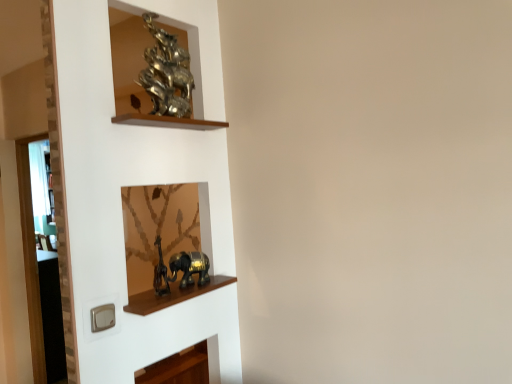
Question: Is the position of wooden shelf at upper center, marked as the first cabinet in a top-to-bottom arrangement, more distant than that of shiny metallic sculpture at upper left, positioned as the 1th art in top-to-bottom order?

Choices:
 (A) yes
 (B) no

Answer: (B)

Question: Does wooden shelf at upper center, marked as the first cabinet in a top-to-bottom arrangement, have a smaller size compared to shiny metallic sculpture at upper left, which is the 2th art in bottom-to-top order?

Choices:
 (A) no
 (B) yes

Answer: (B)

Question: Is wooden shelf at upper center, marked as the first cabinet in a top-to-bottom arrangement, surrounding shiny metallic sculpture at upper left, which is the 2th art in bottom-to-top order?

Choices:
 (A) yes
 (B) no

Answer: (B)

Question: Is wooden shelf at upper center, the 2th cabinet ordered from the bottom, thinner than shiny metallic sculpture at upper left, which is the 2th art in bottom-to-top order?

Choices:
 (A) yes
 (B) no

Answer: (A)

Question: Is wooden shelf at upper center, the 2th cabinet ordered from the bottom, oriented away from shiny metallic sculpture at upper left, positioned as the 1th art in top-to-bottom order?

Choices:
 (A) yes
 (B) no

Answer: (B)

Question: Is wooden shelf at upper center, marked as the first cabinet in a top-to-bottom arrangement, in front of or behind shiny metallic sculpture at upper left, positioned as the 1th art in top-to-bottom order, in the image?

Choices:
 (A) front
 (B) behind

Answer: (A)

Question: Considering the positions of wooden shelf at upper center, the 2th cabinet ordered from the bottom, and shiny metallic sculpture at upper left, positioned as the 1th art in top-to-bottom order, in the image, is wooden shelf at upper center, the 2th cabinet ordered from the bottom, taller or shorter than shiny metallic sculpture at upper left, positioned as the 1th art in top-to-bottom order,?

Choices:
 (A) short
 (B) tall

Answer: (A)

Question: From the image's perspective, is wooden shelf at upper center, marked as the first cabinet in a top-to-bottom arrangement, positioned above or below shiny metallic sculpture at upper left, positioned as the 1th art in top-to-bottom order?

Choices:
 (A) below
 (B) above

Answer: (A)

Question: Considering the positions of wooden shelf at upper center, marked as the first cabinet in a top-to-bottom arrangement, and shiny metallic sculpture at upper left, which is the 2th art in bottom-to-top order, in the image, is wooden shelf at upper center, marked as the first cabinet in a top-to-bottom arrangement, wider or thinner than shiny metallic sculpture at upper left, which is the 2th art in bottom-to-top order,?

Choices:
 (A) thin
 (B) wide

Answer: (A)

Question: Is shiny metallic sculpture at upper left, positioned as the 1th art in top-to-bottom order, in front of or behind wooden shelf at upper center, marked as the first cabinet in a top-to-bottom arrangement, in the image?

Choices:
 (A) behind
 (B) front

Answer: (A)

Question: Is point (166, 102) positioned closer to the camera than point (116, 117)?

Choices:
 (A) closer
 (B) farther

Answer: (B)

Question: Is shiny metallic sculpture at upper left, which is the 2th art in bottom-to-top order, taller or shorter than wooden shelf at upper center, marked as the first cabinet in a top-to-bottom arrangement?

Choices:
 (A) tall
 (B) short

Answer: (A)

Question: In terms of width, does shiny metallic sculpture at upper left, which is the 2th art in bottom-to-top order, look wider or thinner when compared to wooden shelf at upper center, the 2th cabinet ordered from the bottom?

Choices:
 (A) wide
 (B) thin

Answer: (A)

Question: Looking at their shapes, would you say gold metallic elephant at lower center, acting as the 2th art starting from the top, is wider or thinner than wooden shelf at upper center, marked as the first cabinet in a top-to-bottom arrangement?

Choices:
 (A) wide
 (B) thin

Answer: (B)

Question: Is gold metallic elephant at lower center, the 1th art when ordered from bottom to top, situated inside wooden shelf at upper center, the 2th cabinet ordered from the bottom, or outside?

Choices:
 (A) inside
 (B) outside

Answer: (B)